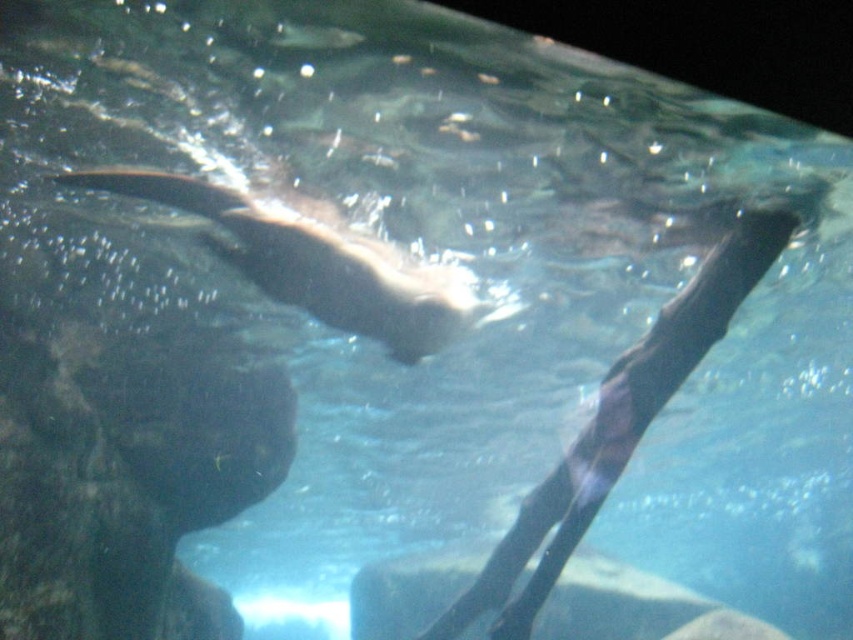
You are a marine biologist observing the underwater scene. You notice a smooth black seal at center and a shiny brown otter at center. Which of these two animals is located to the right of the other?

The smooth black seal at center is positioned on the right side of the shiny brown otter at center.

You are a marine biologist observing an underwater scene. You notice a smooth black seal at center and a smooth gray rock at center. Which object is wider? Please base your answer on the scene description provided.

The smooth gray rock at center is wider than the smooth black seal at center.